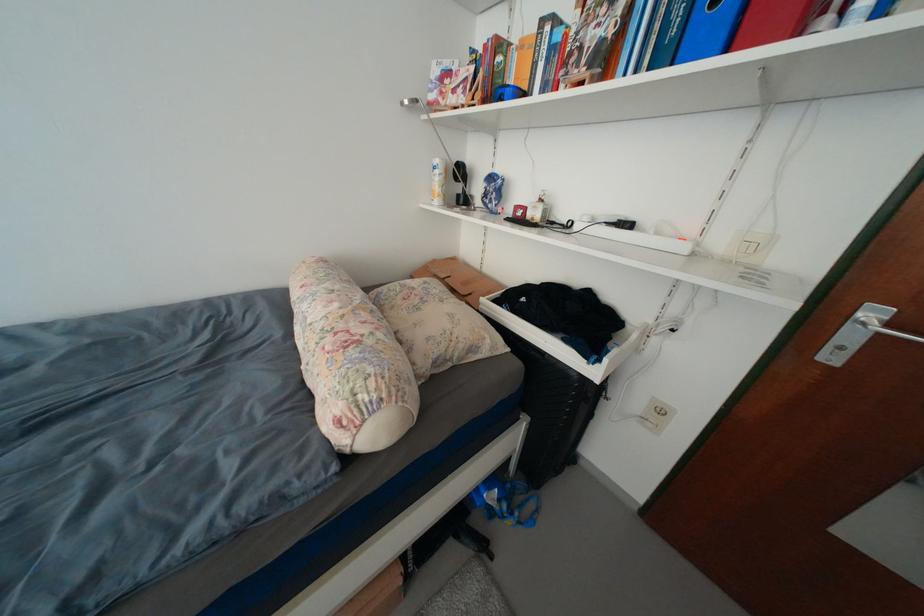
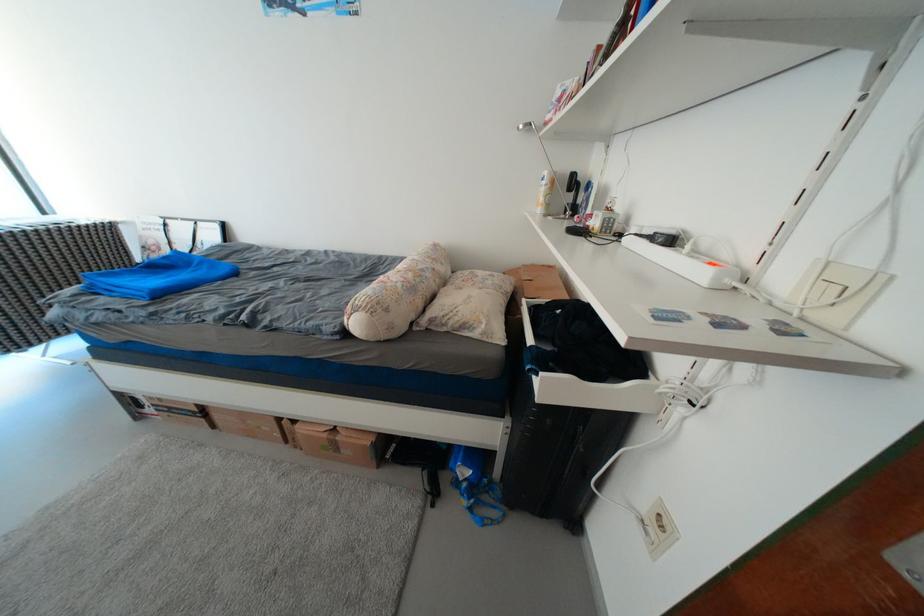
The point at (x=445, y=174) is marked in the first image. Where is the corresponding point in the second image?

(553, 185)